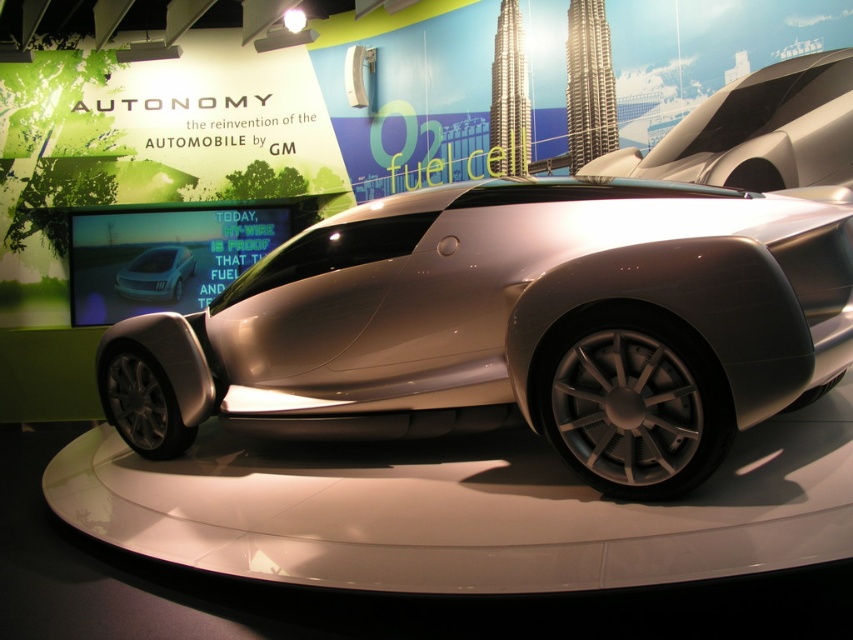
You are standing at the exhibition and want to take a photo of the silver metallic car at center. If your camera can focus on objects up to 5 feet away, will you need to step back to ensure it is in focus?

The silver metallic car at center is 6.02 feet away from the viewer. Since the camera can only focus up to 5 feet, you need to step back further to ensure the car is within the camera focus range.

You are standing at the entrance of the auto show and see the silver metallic car at center. If you want to walk directly towards it, which direction should you move from your current position?

Since the silver metallic car at center is located at point (x=514, y=324), you should move forward towards the center of the exhibition hall to reach it.

You are an auto designer evaluating two concept cars at an exhibition. You notice the silver metallic car at center and the satin silver car at center. Which one is taller?

The silver metallic car at center is taller than the satin silver car at center.